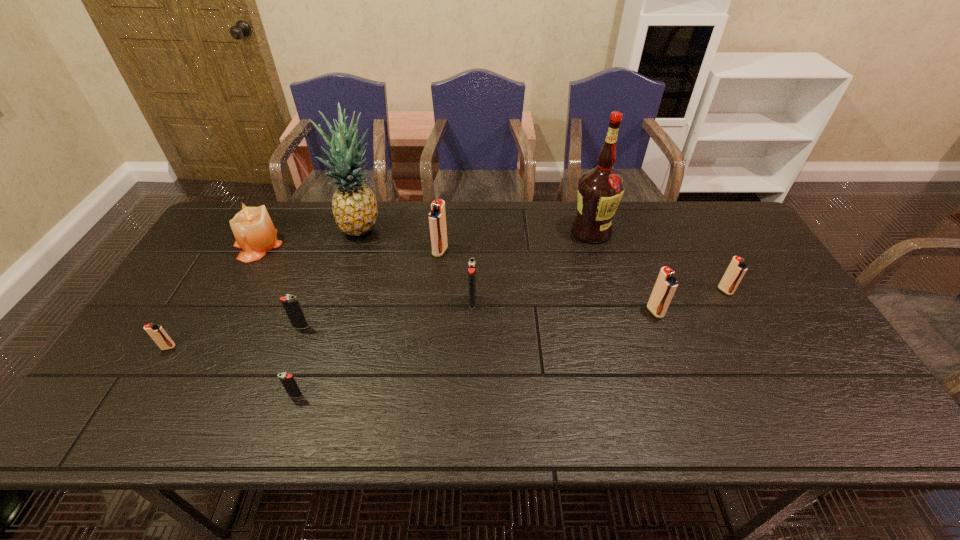
The width and height of the screenshot is (960, 540). I want to click on pineapple, so click(354, 206).

You are a GUI agent. You are given a task and a screenshot of the screen. Output one action in this format:
    pyautogui.click(x=<x>, y=<y>)
    Task: Click on the alcohol
    Image resolution: width=960 pixels, height=540 pixels.
    Given the screenshot: What is the action you would take?
    pyautogui.click(x=600, y=189)

Find the location of a particular element. This screenshot has height=540, width=960. the third object from right to left is located at coordinates (600, 189).

Where is `the fourth igniter from right to left`? the fourth igniter from right to left is located at coordinates (437, 217).

Find the location of a particular element. the fifth object from right to left is located at coordinates (437, 217).

This screenshot has width=960, height=540. What are the coordinates of `beige candle` in the screenshot? It's located at (253, 229).

Identify the location of the second biggest red igniter. The image size is (960, 540). (665, 286).

The height and width of the screenshot is (540, 960). I want to click on the third farthest red igniter, so click(665, 286).

Identify the location of the biggest black igniter. (471, 264).

At what (x,y) coordinates should I click in order to perform the action: click on the third igniter from right to left. Please return your answer as a coordinate pair (x, y). Looking at the image, I should click on (471, 264).